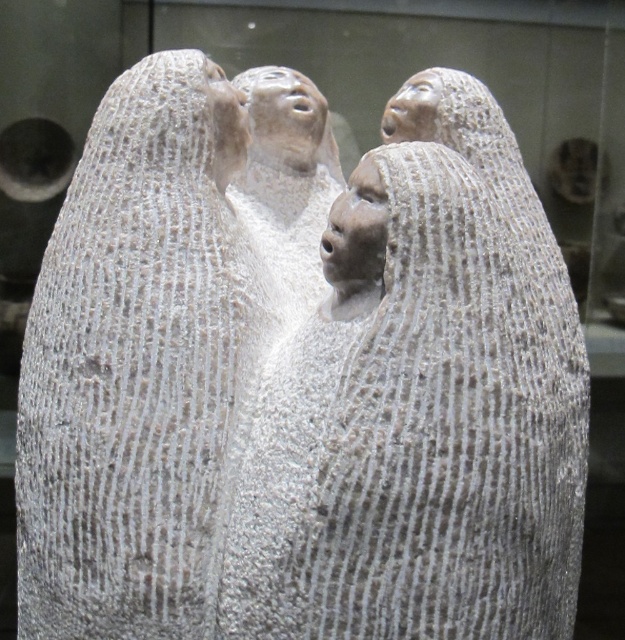
Question: Is gray textured stone figures at center below white textured stone head at upper center?

Choices:
 (A) no
 (B) yes

Answer: (B)

Question: Does white textured stone head at upper center have a smaller size compared to gray textured stone head at upper center?

Choices:
 (A) no
 (B) yes

Answer: (A)

Question: Among these points, which one is farthest from the camera?

Choices:
 (A) (496, 458)
 (B) (200, 576)
 (C) (152, 54)

Answer: (C)

Question: Does gray textured stone statue at upper center have a lesser width compared to gray textured stone head at upper center?

Choices:
 (A) no
 (B) yes

Answer: (A)

Question: Among these points, which one is nearest to the camera?

Choices:
 (A) (416, 196)
 (B) (212, 84)

Answer: (A)

Question: Which of these objects is positioned closest to the gray textured stone statue at upper center?

Choices:
 (A) gray textured stone head at center
 (B) matte gray stone head at upper center
 (C) white textured stone head at upper center
 (D) gray textured stone head at upper center

Answer: (C)